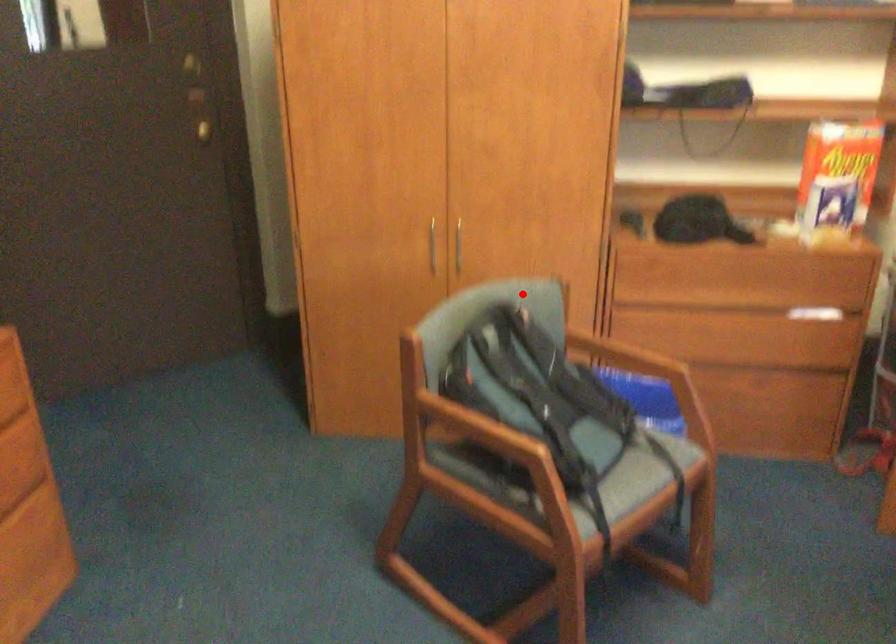
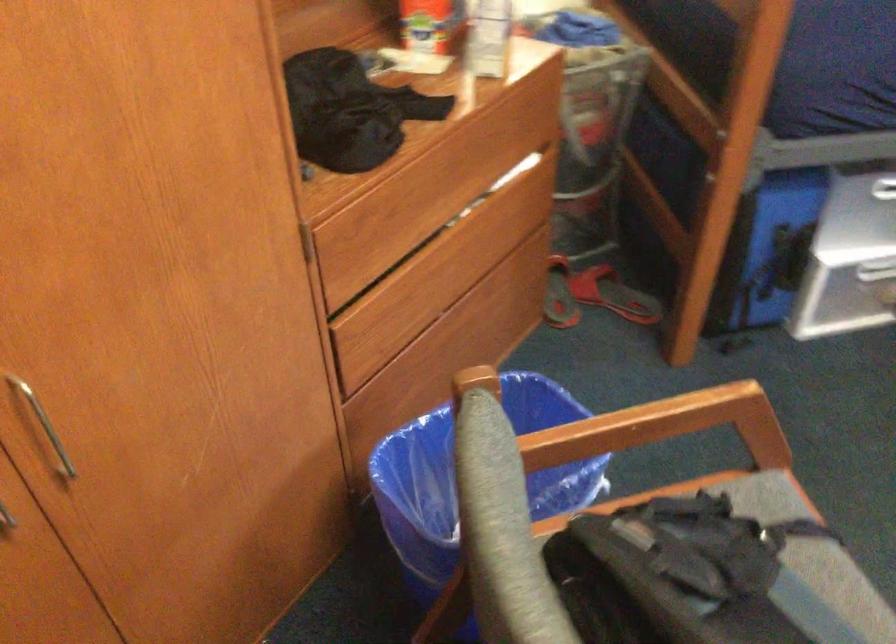
Locate, in the second image, the point that corresponds to the highlighted location in the first image.

(487, 460)